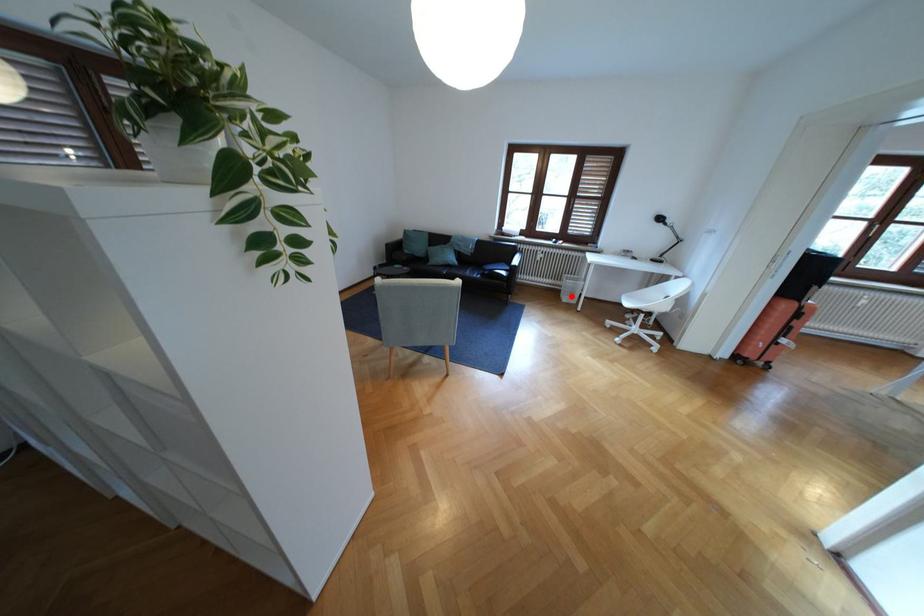
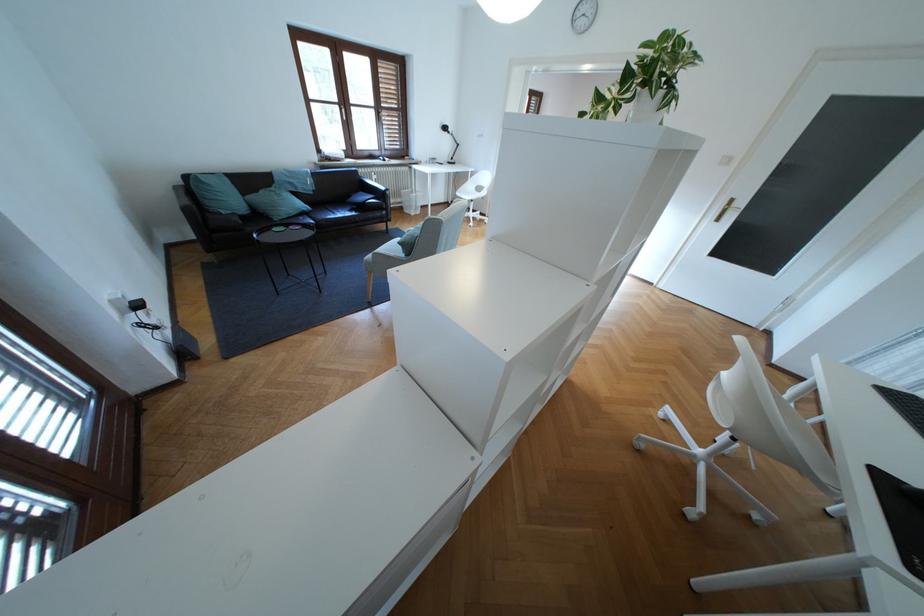
Question: A red point is marked in image1. In image2, is the corresponding 3D point closer to the camera or farther? Reply with the corresponding letter.

Choices:
 (A) The corresponding 3D point is closer.
 (B) The corresponding 3D point is farther.

Answer: (B)